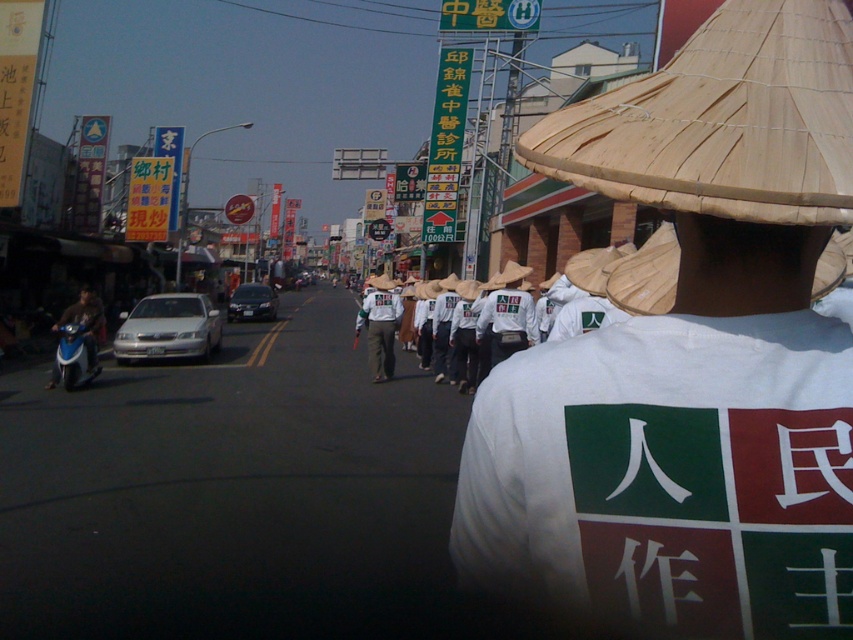
From the picture: You are a delivery person who needs to deliver a package to a recipient located at the position of the black matte helmet at center. You are currently standing at the position of the white cotton shirt at center. Given that your delivery vehicle can only move in a straight line and has a maximum range of 10 meters, will you be able to reach the destination without recharging?

The distance between the white cotton shirt at center and the black matte helmet at center is 9.79 meters, which is within the delivery vehicle maximum range of 10 meters. Therefore, you can reach the destination without recharging.

You are a photographer standing 30 inches away from the white straw hat at center. Can you comfortably take a photo of it without needing to move closer?

The white straw hat at center is 31.76 inches away from the viewer. Since you are standing 30 inches away, you need to move back 1.76 inches to comfortably take the photo without being too close.

You are standing at point (82, 304) and want to walk to point (529, 560). Which direction should you move in to reach your destination?

You should move towards the direction of the camera because point (529, 560) is closer to the camera than point (82, 304).